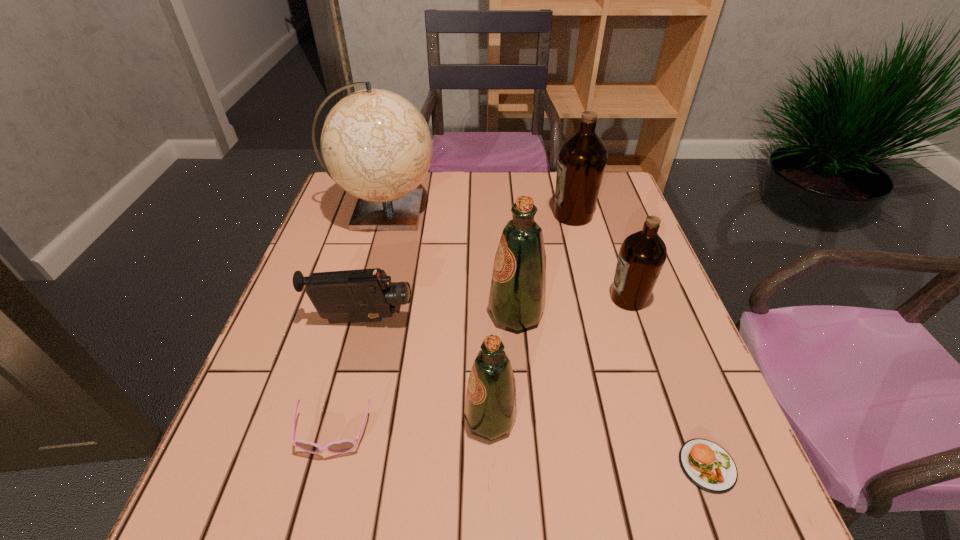
You are a GUI agent. You are given a task and a screenshot of the screen. Output one action in this format:
    pyautogui.click(x=<x>, y=<y>)
    Task: Click on the beige globe
    This screenshot has height=540, width=960.
    Given the screenshot: What is the action you would take?
    377,146

Find the location of `globe`. globe is located at coordinates (377, 146).

You are a GUI agent. You are given a task and a screenshot of the screen. Output one action in this format:
    pyautogui.click(x=<x>, y=<y>)
    Task: Click on the bigger green olive oil
    The width and height of the screenshot is (960, 540).
    Given the screenshot: What is the action you would take?
    pyautogui.click(x=518, y=287)

Image resolution: width=960 pixels, height=540 pixels. Identify the location of the bigger brown olive oil. (582, 158).

Where is `the farther brown olive oil`? the farther brown olive oil is located at coordinates (582, 158).

Find the location of `the smaller green olive oil`. the smaller green olive oil is located at coordinates (490, 410).

The image size is (960, 540). Identify the location of the nearest olive oil. (490, 410).

Identify the location of the smaller brown olive oil. (642, 255).

Where is `the third shortest object`? Image resolution: width=960 pixels, height=540 pixels. the third shortest object is located at coordinates (363, 295).

Image resolution: width=960 pixels, height=540 pixels. Find the location of `camcorder`. camcorder is located at coordinates (363, 295).